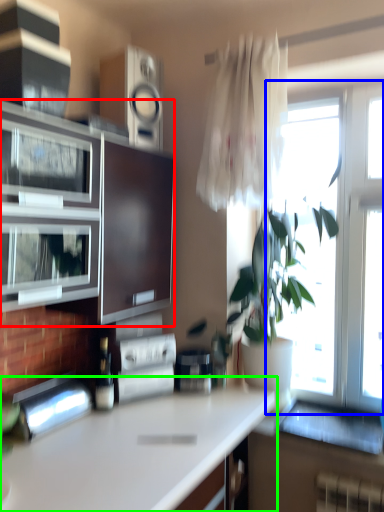
Question: Estimate the real-world distances between objects in this image. Which object is closer to cabinetry (highlighted by a red box), window (highlighted by a blue box) or countertop (highlighted by a green box)?

Choices:
 (A) window
 (B) countertop

Answer: (B)